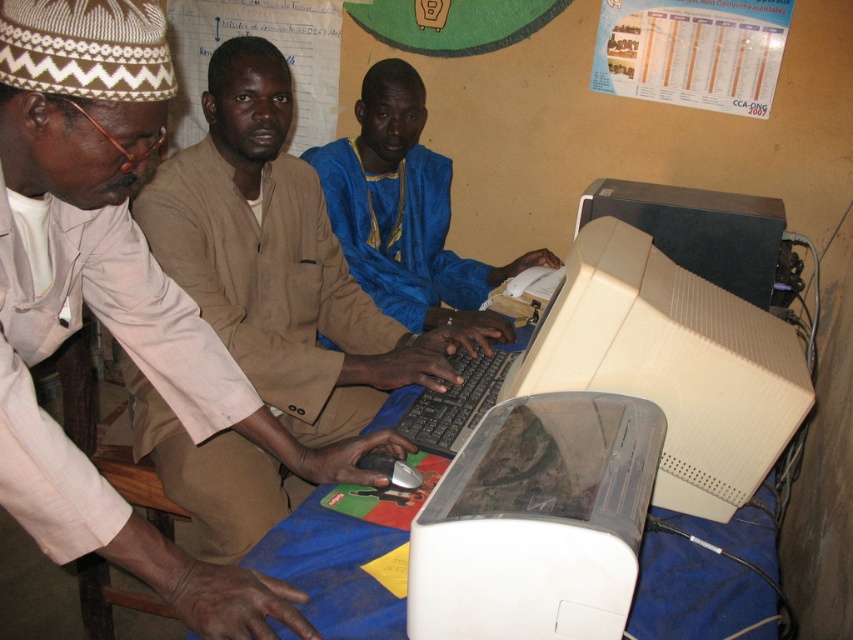
Question: Is matte beige suit at center to the left of blue satin shirt at center from the viewer's perspective?

Choices:
 (A) no
 (B) yes

Answer: (B)

Question: Which point appears closest to the camera in this image?

Choices:
 (A) (50, 419)
 (B) (369, 76)

Answer: (A)

Question: Is matte beige suit at center smaller than blue satin shirt at center?

Choices:
 (A) no
 (B) yes

Answer: (B)

Question: Which object is closer to the camera taking this photo?

Choices:
 (A) matte beige suit at center
 (B) blue satin shirt at center

Answer: (A)

Question: Is matte beige suit at center to the right of blue satin shirt at center from the viewer's perspective?

Choices:
 (A) no
 (B) yes

Answer: (A)

Question: Which point is farther to the camera?

Choices:
 (A) (219, 579)
 (B) (389, 224)

Answer: (B)